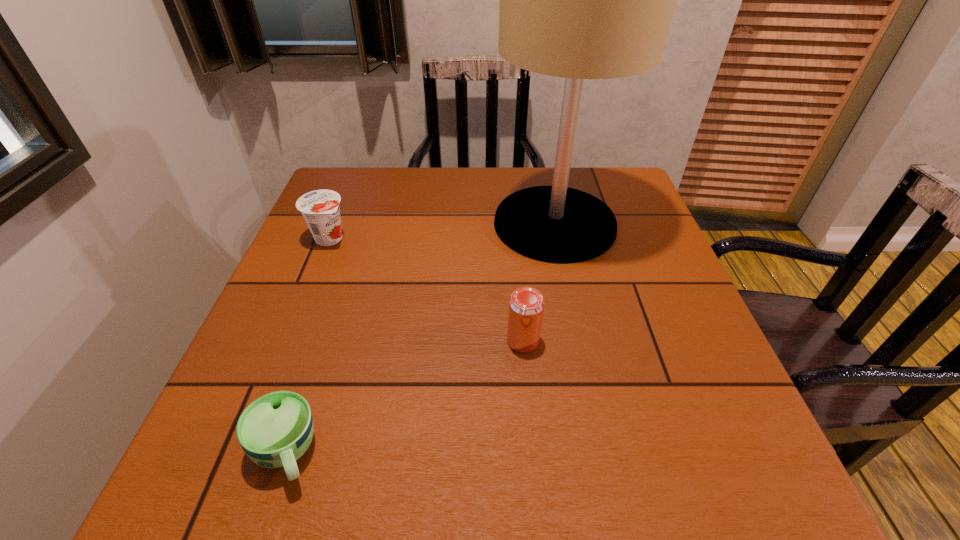
Identify the location of vacant point located between the beer can and the tallest object. (539, 282).

Find the location of a particular element. The width and height of the screenshot is (960, 540). free space between the yogurt and the nearest object is located at coordinates (307, 345).

At what (x,y) coordinates should I click in order to perform the action: click on vacant area that lies between the yogurt and the tallest object. Please return your answer as a coordinate pair (x, y). Looking at the image, I should click on (442, 231).

Locate which object ranks in proximity to the tallest object. Please provide its 2D coordinates. Your answer should be formatted as a tuple, i.e. [(x, y)], where the tuple contains the x and y coordinates of a point satisfying the conditions above.

[(526, 304)]

Where is `object that is the second nearest to the beer can`? Image resolution: width=960 pixels, height=540 pixels. object that is the second nearest to the beer can is located at coordinates (276, 429).

Find the location of a particular element. This screenshot has width=960, height=540. free spot that satisfies the following two spatial constraints: 1. on the front side of the yogurt; 2. on the left side of the shortest object is located at coordinates (243, 452).

Locate an element on the screen. The image size is (960, 540). vacant space that satisfies the following two spatial constraints: 1. on the back side of the tallest object; 2. on the left side of the yogurt is located at coordinates (335, 224).